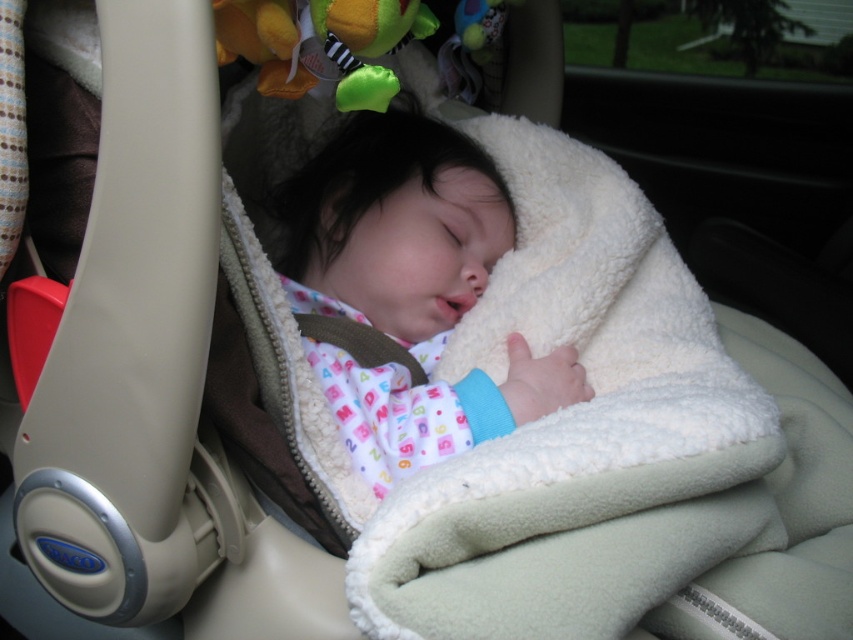
Question: Which point is farther to the camera?

Choices:
 (A) white fleece blanket at center
 (B) soft plush frog at upper center

Answer: (B)

Question: Estimate the real-world distances between objects in this image. Which object is farther from the soft plush frog at upper center?

Choices:
 (A) white fleece blanket at center
 (B) white fleece baby at center

Answer: (A)

Question: Among these points, which one is farthest from the camera?

Choices:
 (A) (384, 88)
 (B) (335, 298)

Answer: (B)

Question: Does white fleece blanket at center come in front of white fleece baby at center?

Choices:
 (A) yes
 (B) no

Answer: (A)

Question: Is white fleece blanket at center to the left of soft plush frog at upper center from the viewer's perspective?

Choices:
 (A) yes
 (B) no

Answer: (B)

Question: Is white fleece blanket at center positioned behind soft plush frog at upper center?

Choices:
 (A) yes
 (B) no

Answer: (B)